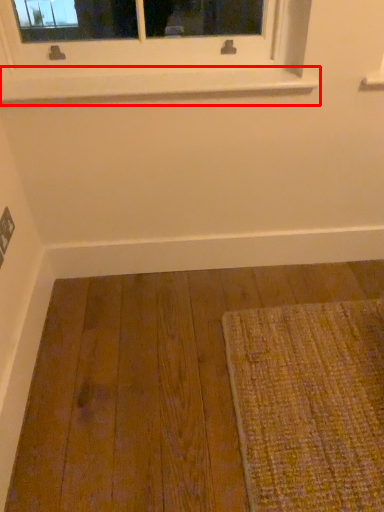
Question: From the image's perspective, considering the relative positions of window sill (annotated by the red box) and molding in the image provided, where is window sill (annotated by the red box) located with respect to the staircase?

Choices:
 (A) below
 (B) above

Answer: (B)